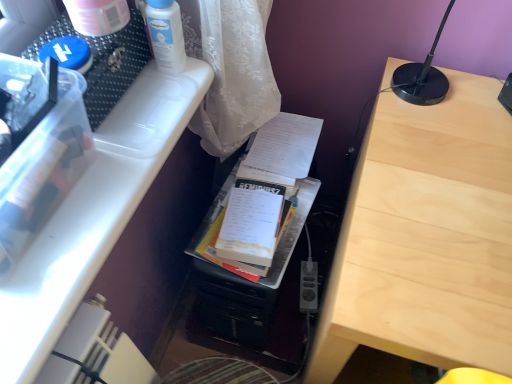
Question: Choose the correct answer: Is white glossy lotion at upper center inside black plastic power plugs and sockets at lower center or outside it?

Choices:
 (A) inside
 (B) outside

Answer: (B)

Question: Considering the positions of white glossy lotion at upper center and black plastic power plugs and sockets at lower center in the image, is white glossy lotion at upper center bigger or smaller than black plastic power plugs and sockets at lower center?

Choices:
 (A) small
 (B) big

Answer: (B)

Question: Which object is positioned farthest from the white paper at center?

Choices:
 (A) light wood table at center
 (B) white glossy lotion at upper center
 (C) black plastic power plugs and sockets at lower center
 (D) white plastic container at upper left

Answer: (C)

Question: Which object is positioned farthest from the white plastic container at upper left?

Choices:
 (A) light wood table at center
 (B) white paper at center
 (C) white glossy lotion at upper center
 (D) black plastic power plugs and sockets at lower center

Answer: (D)